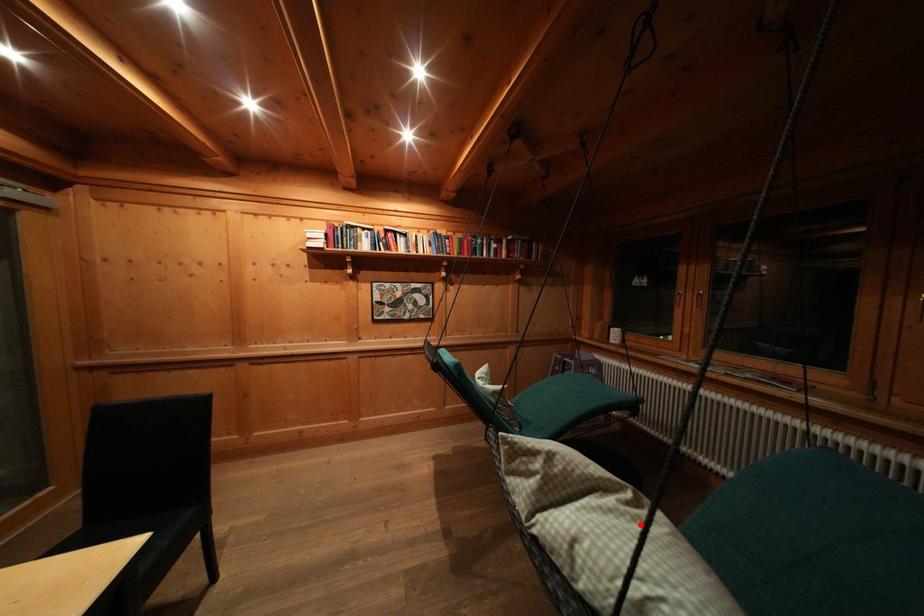
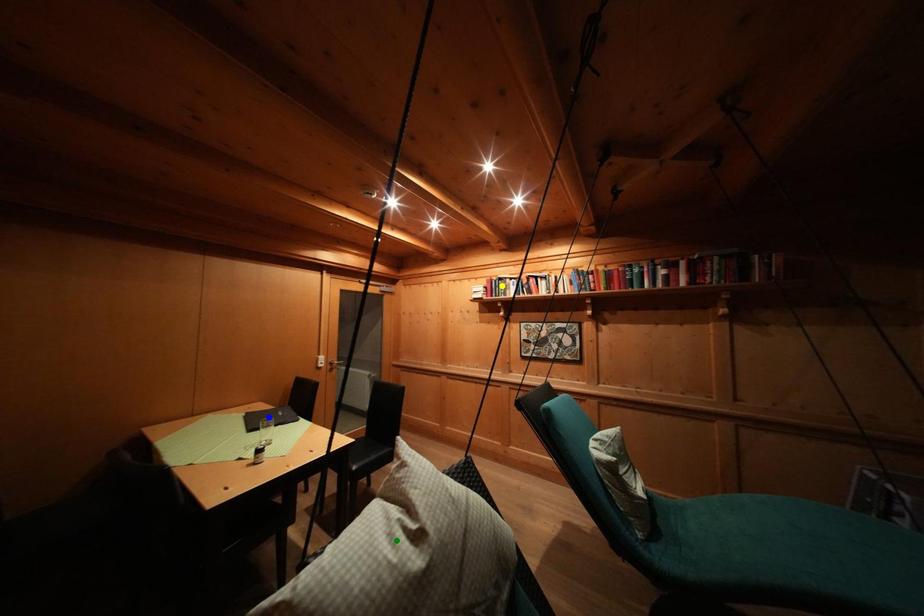
Question: I am providing you with two images of the same scene from different viewpoints. A red point is marked on the first image. You are given multiple points on the second image. Which spot in image 2 lines up with the point in image 1?

Choices:
 (A) blue point
 (B) yellow point
 (C) green point

Answer: (C)